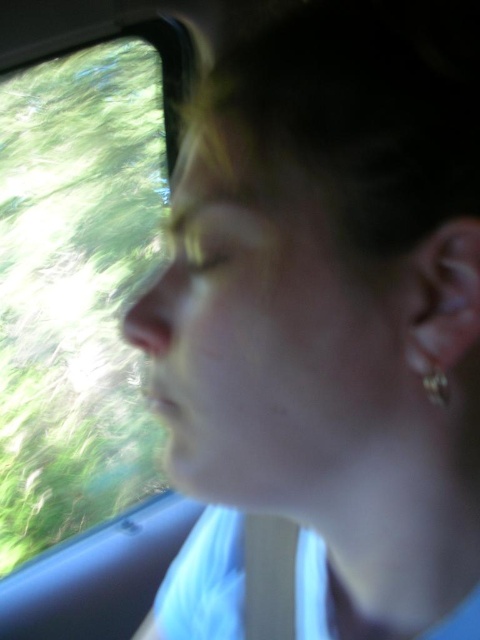
Question: Is transparent glass window at left below silver metallic earring at ear?

Choices:
 (A) yes
 (B) no

Answer: (B)

Question: Which point appears closest to the camera in this image?

Choices:
 (A) (117, 284)
 (B) (425, 376)

Answer: (B)

Question: Does transparent glass window at left appear over silver metallic earring at ear?

Choices:
 (A) yes
 (B) no

Answer: (A)

Question: Which of the following is the farthest from the observer?

Choices:
 (A) transparent glass window at left
 (B) silver metallic earring at ear

Answer: (A)

Question: Can you confirm if transparent glass window at left is smaller than silver metallic earring at ear?

Choices:
 (A) no
 (B) yes

Answer: (A)